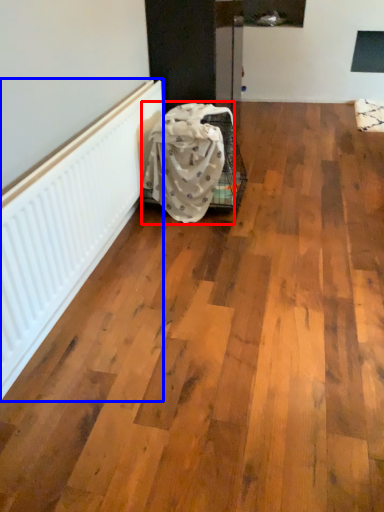
Question: Among these objects, which one is nearest to the camera, blanket (highlighted by a red box) or radiator (highlighted by a blue box)?

Choices:
 (A) blanket
 (B) radiator

Answer: (B)